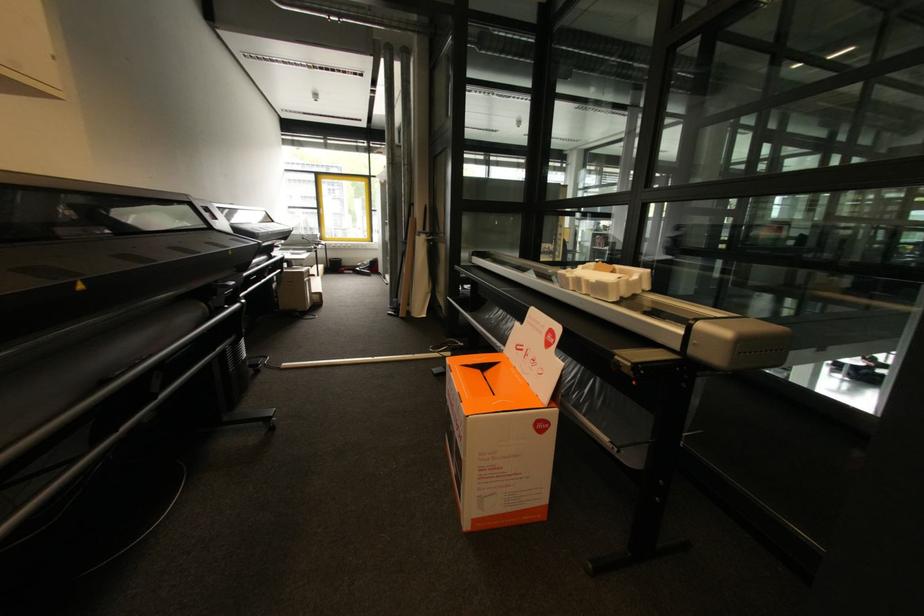
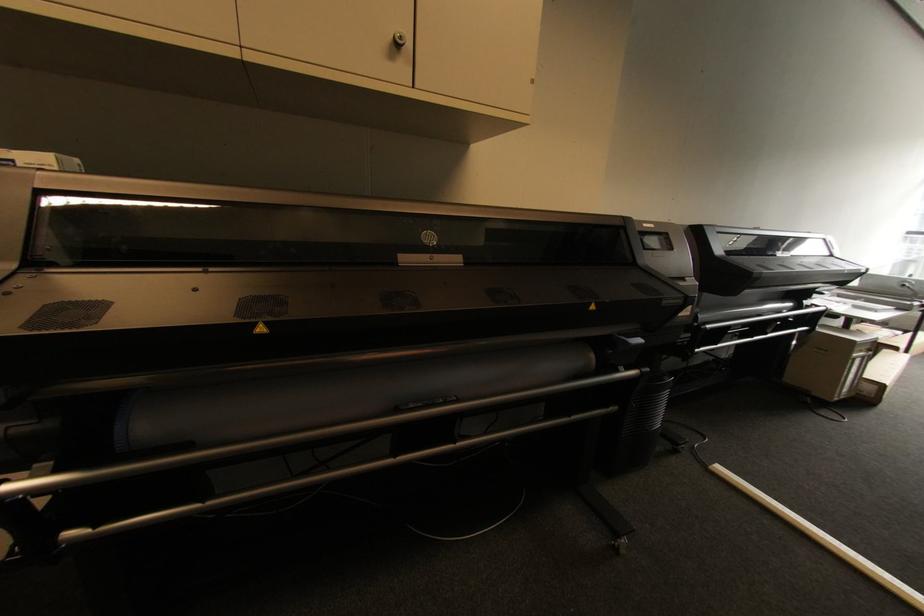
The point at (310, 278) is marked in the first image. Where is the corresponding point in the second image?

(867, 352)